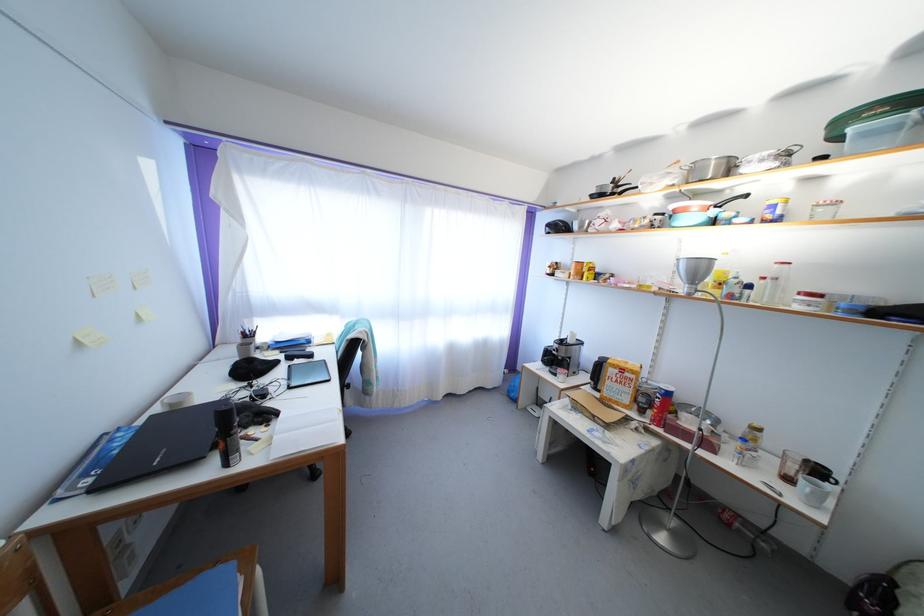
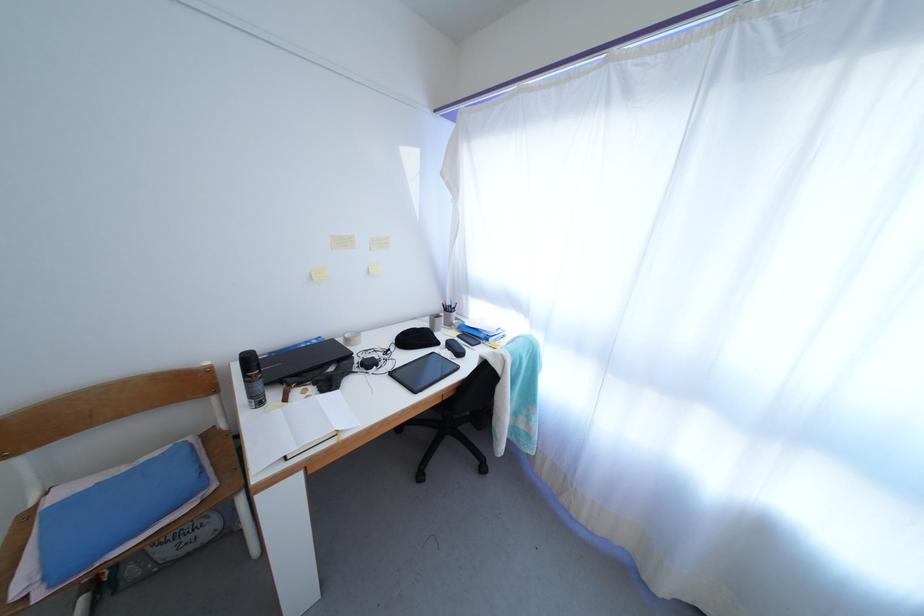
The point at (237, 440) is marked in the first image. Where is the corresponding point in the second image?

(250, 387)